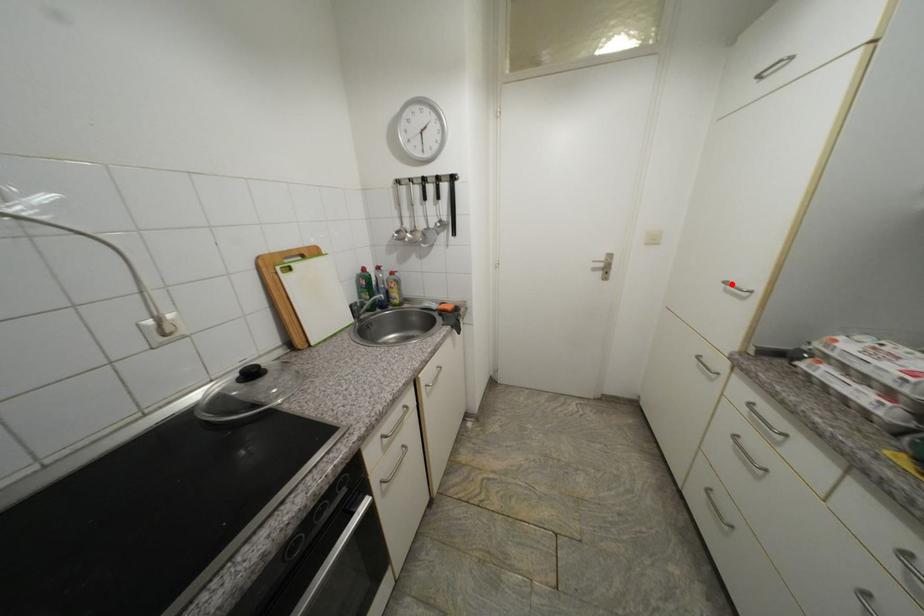
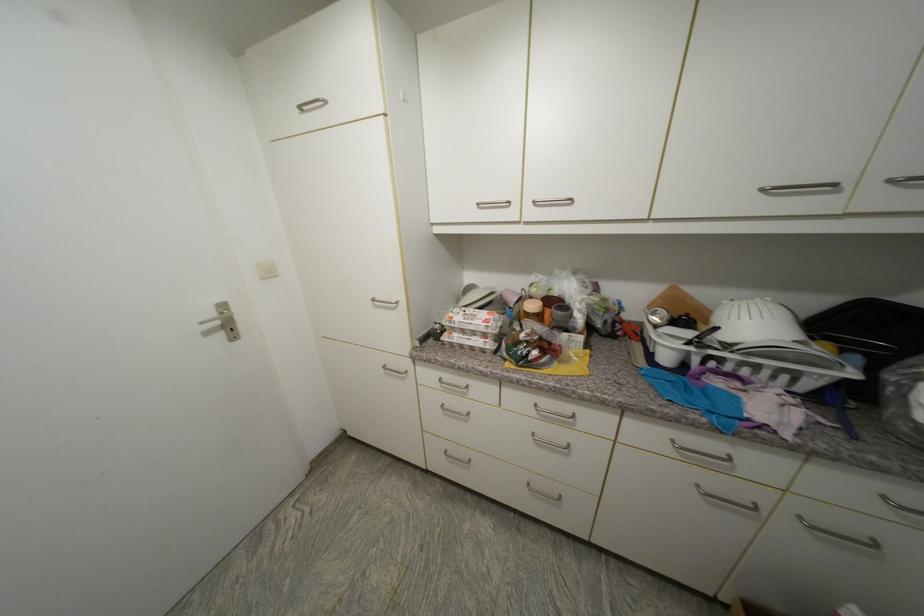
Find the pixel in the second image that matches the highlighted location in the first image.

(379, 301)